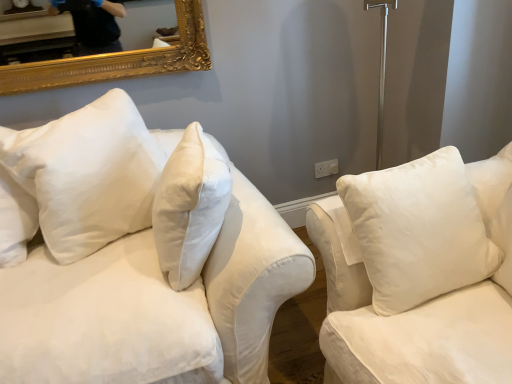
Question: In the image, is white cotton couch at left on the left side or the right side of white plastic electric outlet at center-right?

Choices:
 (A) left
 (B) right

Answer: (A)

Question: From a real-world perspective, is white cotton couch at left physically located above or below white plastic electric outlet at center-right?

Choices:
 (A) above
 (B) below

Answer: (A)

Question: Which is nearer to the white cotton pillow at upper left, the 1th pillow positioned from the left?

Choices:
 (A) white plastic electric outlet at center-right
 (B) white soft cushion at right, the 1th pillow viewed from the right
 (C) white cotton couch at left

Answer: (C)

Question: Estimate the real-world distances between objects in this image. Which object is closer to the white plastic electric outlet at center-right?

Choices:
 (A) white soft cushion at right, the 1th pillow viewed from the right
 (B) white cotton pillow at upper left, the second pillow positioned from the right
 (C) white cotton couch at left

Answer: (A)